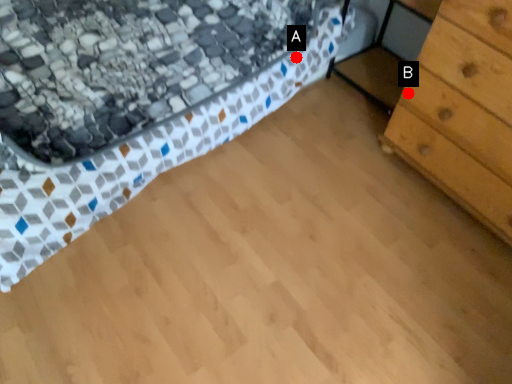
Question: Two points are circled on the image, labeled by A and B beside each circle. Which point is closer to the camera?

Choices:
 (A) A is closer
 (B) B is closer

Answer: (B)